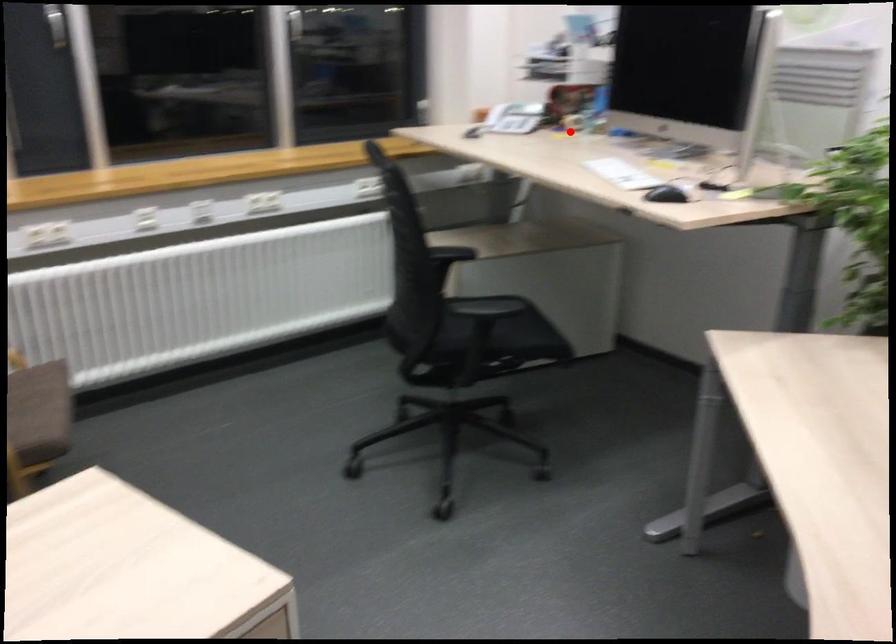
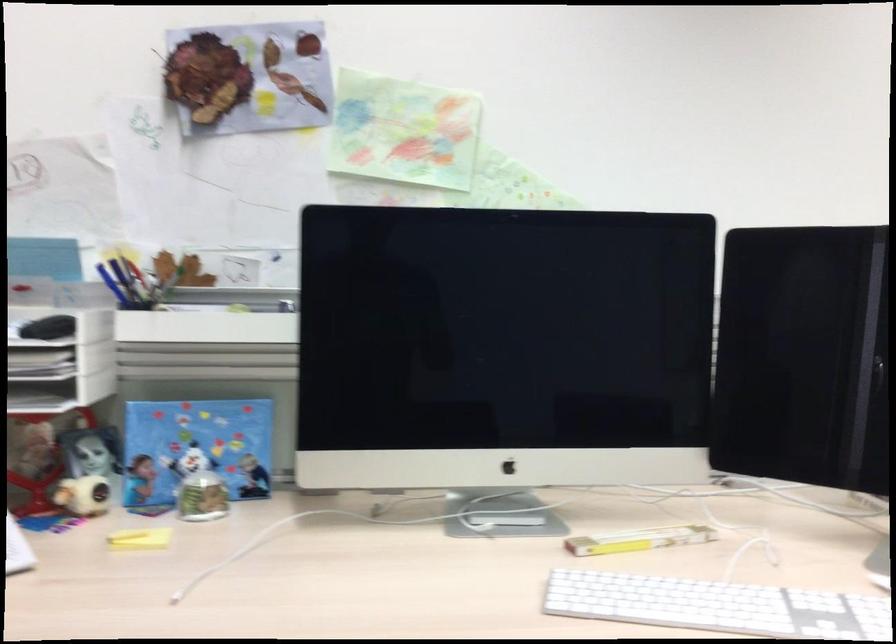
The point at the highlighted location is marked in the first image. Where is the corresponding point in the second image?

(140, 538)